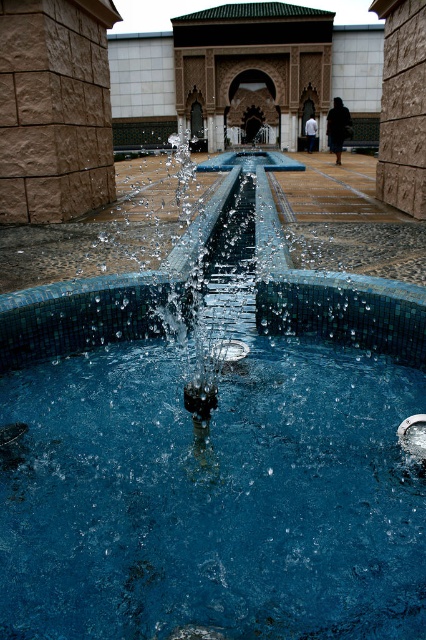
You are standing in front of the fountain and want to locate two specific points marked in the image. The first point is at coordinates point (26,458) and the second is at point (302,68). Which of these points is nearer to your current position?

Point (26,458) is closer to the viewer than point (302,68), so the first point is nearer to your current position.

You are designing a garden layout and need to ensure proper spacing between the blue glossy water at center and the blue mosaic fountain at center. Based on the scene, which object occupies more space in the central area?

The blue mosaic fountain at center occupies more space in the central area than the blue glossy water at center, as the blue glossy water at center is smaller than the blue mosaic fountain at center according to the description.